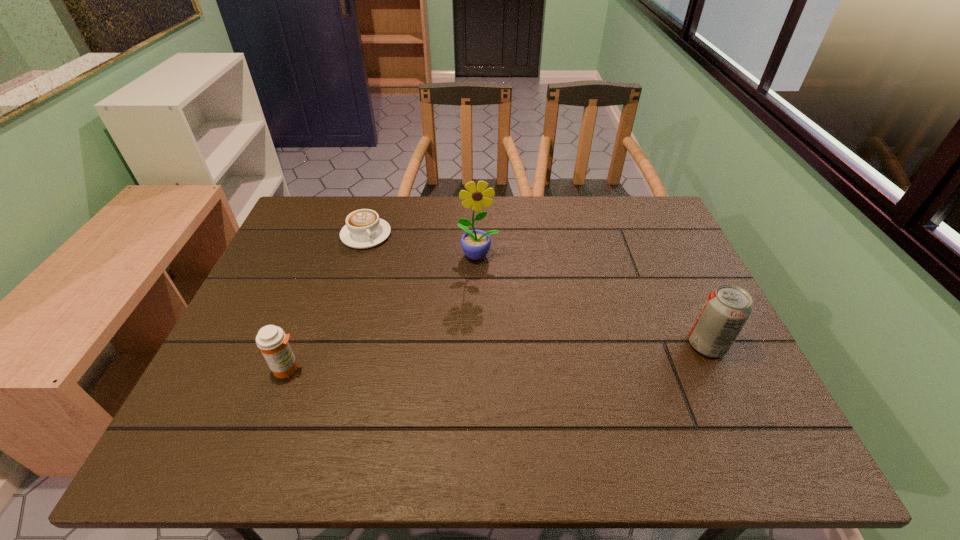
Locate an element on the screen. blank area located with the handle on the right side of the cappuccino is located at coordinates (443, 332).

Where is `vacant space located on the front-facing side of the tallest object`? The image size is (960, 540). vacant space located on the front-facing side of the tallest object is located at coordinates (492, 363).

Locate an element on the screen. This screenshot has height=540, width=960. free region located 0.190m on the front-facing side of the tallest object is located at coordinates (486, 315).

You are a GUI agent. You are given a task and a screenshot of the screen. Output one action in this format:
    pyautogui.click(x=<x>, y=<y>)
    Task: Click on the free space located on the front-facing side of the tallest object
    
    Given the screenshot: What is the action you would take?
    pyautogui.click(x=487, y=327)

At what (x,y) coordinates should I click in order to perform the action: click on object that is at the far edge. Please return your answer as a coordinate pair (x, y). This screenshot has width=960, height=540. Looking at the image, I should click on (364, 229).

You are a GUI agent. You are given a task and a screenshot of the screen. Output one action in this format:
    pyautogui.click(x=<x>, y=<y>)
    Task: Click on the object that is at the near edge
    The height and width of the screenshot is (540, 960).
    Given the screenshot: What is the action you would take?
    pyautogui.click(x=272, y=341)

Image resolution: width=960 pixels, height=540 pixels. In order to click on object positioned at the left edge in this screenshot , I will do click(x=272, y=341).

This screenshot has width=960, height=540. I want to click on object positioned at the right edge, so click(727, 308).

This screenshot has width=960, height=540. Find the location of `object positioned at the near left corner`. object positioned at the near left corner is located at coordinates [x=272, y=341].

Where is `free region at the far edge of the desktop`? This screenshot has width=960, height=540. free region at the far edge of the desktop is located at coordinates (439, 227).